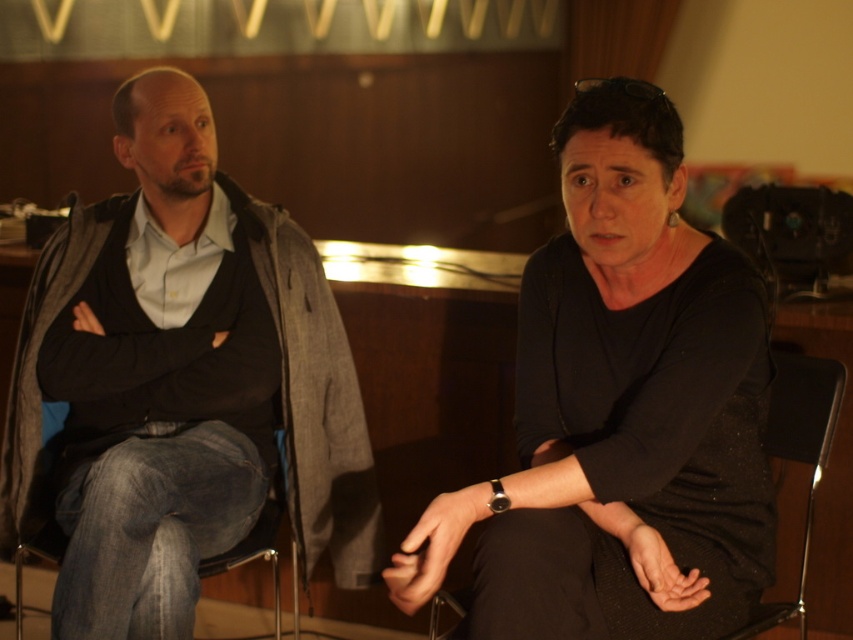
Does dark gray sweater at left have a greater height compared to black fabric chair at center?

Correct, dark gray sweater at left is much taller as black fabric chair at center.

Locate an element on the screen. The width and height of the screenshot is (853, 640). dark gray sweater at left is located at coordinates (160, 381).

Does dark gray sweater at left have a lesser width compared to denim fabric at left?

No, dark gray sweater at left is not thinner than denim fabric at left.

Which is below, dark gray sweater at left or denim fabric at left?

denim fabric at left is below.

This screenshot has width=853, height=640. Identify the location of dark gray sweater at left. (160, 381).

Is black matte shirt at center smaller than black fabric chair at center?

Incorrect, black matte shirt at center is not smaller in size than black fabric chair at center.

Describe the element at coordinates (625, 406) in the screenshot. I see `black matte shirt at center` at that location.

The image size is (853, 640). What are the coordinates of `black matte shirt at center` in the screenshot? It's located at (625, 406).